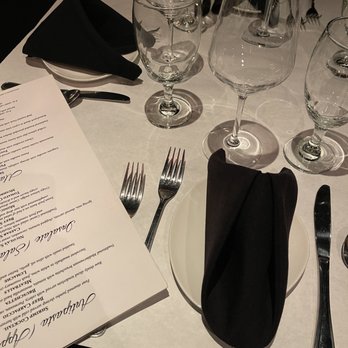
Locate an element on the screen. The height and width of the screenshot is (348, 348). white tablecloth is located at coordinates (128, 130).